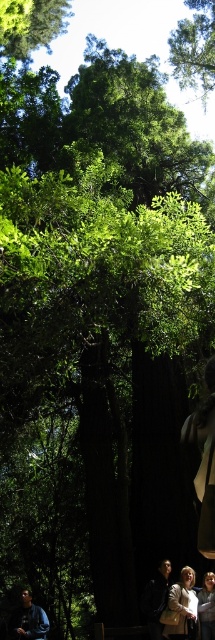
You are a photographer aiming to capture both the blue denim jacket at lower left and the light brown leather jacket at lower right in a single frame. Based on their positions, which jacket will appear closer to the bottom edge of the photo?

The blue denim jacket at lower left will appear closer to the bottom edge of the photo because it is located below the light brown leather jacket at lower right.

You are a photographer wanting to capture both the blue denim jacket at lower left and the light brown leather jacket at lower right in the same frame. Based on their positions, which jacket should you focus on first to ensure both are in the shot?

You should focus on the blue denim jacket at lower left first because it is positioned to the left of the light brown leather jacket at lower right, so by centering the blue denim jacket at lower left, the light brown leather jacket at lower right will naturally fall into the frame to its right side.